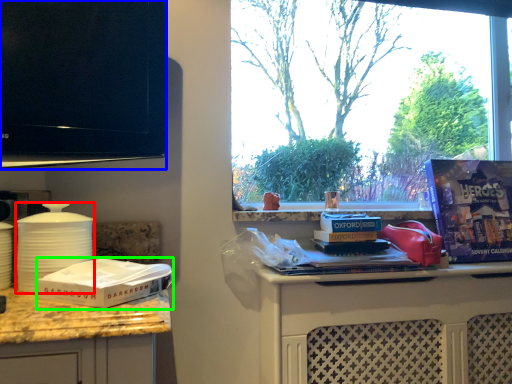
Question: Which is farther away from kitchen appliance (highlighted by a red box)? television (highlighted by a blue box) or box (highlighted by a green box)?

Choices:
 (A) television
 (B) box

Answer: (A)